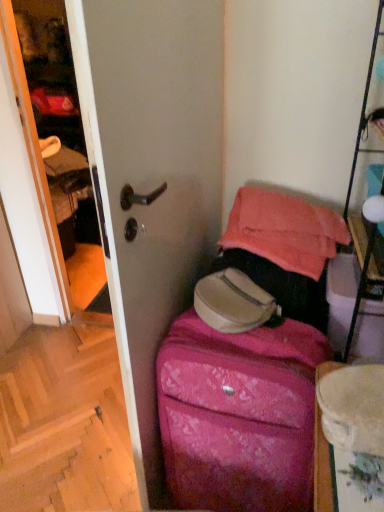
What do you see at coordinates (64, 423) in the screenshot? The width and height of the screenshot is (384, 512). I see `wooden at lower left` at bounding box center [64, 423].

Describe the element at coordinates (239, 415) in the screenshot. The height and width of the screenshot is (512, 384). I see `pink textured suitcase at center` at that location.

This screenshot has width=384, height=512. Identify the location of pink fabric suitcase at lower right. 153,180.

Can you confirm if wooden at lower left is shorter than pink fabric suitcase at lower right?

Indeed, wooden at lower left has a lesser height compared to pink fabric suitcase at lower right.

Image resolution: width=384 pixels, height=512 pixels. I want to click on screen door on the right of wooden at lower left, so click(153, 180).

Is wooden at lower left in front of or behind pink fabric suitcase at lower right in the image?

Visually, wooden at lower left is located behind pink fabric suitcase at lower right.

Considering the points (98, 362) and (156, 133), which point is behind, point (98, 362) or point (156, 133)?

Point (98, 362)

From the image's perspective, which object appears higher, pink fabric suitcase at lower right or wooden at lower left?

From the image's view, pink fabric suitcase at lower right is above.

I want to click on stairwell on the left of pink fabric suitcase at lower right, so click(x=64, y=423).

Would you say pink fabric suitcase at lower right is inside or outside wooden at lower left?

pink fabric suitcase at lower right lies outside wooden at lower left.

Is pink fabric suitcase at lower right to the right of wooden at lower left from the viewer's perspective?

Yes, pink fabric suitcase at lower right is to the right of wooden at lower left.

From the image's perspective, is pink textured suitcase at center on wooden at lower left?

Indeed, from the image's perspective, pink textured suitcase at center is shown above wooden at lower left.

From a real-world perspective, is pink textured suitcase at center positioned above or below wooden at lower left?

pink textured suitcase at center is above wooden at lower left.

Image resolution: width=384 pixels, height=512 pixels. Find the location of `stairwell below the pink textured suitcase at center (from the image's perspective)`. stairwell below the pink textured suitcase at center (from the image's perspective) is located at coordinates (64, 423).

Which object is positioned more to the left, pink textured suitcase at center or wooden at lower left?

Positioned to the left is wooden at lower left.

Considering the positions of objects pink fabric suitcase at lower right and pink textured suitcase at center in the image provided, who is more to the left, pink fabric suitcase at lower right or pink textured suitcase at center?

pink fabric suitcase at lower right is more to the left.

Can you confirm if pink fabric suitcase at lower right is smaller than pink textured suitcase at center?

Incorrect, pink fabric suitcase at lower right is not smaller in size than pink textured suitcase at center.

Considering the relative positions of pink fabric suitcase at lower right and pink textured suitcase at center in the image provided, is pink fabric suitcase at lower right behind pink textured suitcase at center?

No, pink fabric suitcase at lower right is closer to the camera.

Looking at this image, is pink fabric suitcase at lower right situated inside pink textured suitcase at center or outside?

The correct answer is: outside.

Locate an element on the screen. The image size is (384, 512). luggage in front of the wooden at lower left is located at coordinates (239, 415).

Is pink textured suitcase at center inside wooden at lower left?

Definitely not — pink textured suitcase at center is not inside wooden at lower left.

Looking at this image, between wooden at lower left and pink textured suitcase at center, which one appears on the left side from the viewer's perspective?

From the viewer's perspective, wooden at lower left appears more on the left side.

From the image's perspective, which is below, pink textured suitcase at center or pink fabric suitcase at lower right?

pink textured suitcase at center.

Could you tell me if pink textured suitcase at center is turned towards pink fabric suitcase at lower right?

No, pink textured suitcase at center is not facing towards pink fabric suitcase at lower right.

Where is `screen door above the pink textured suitcase at center (from the image's perspective)`? Image resolution: width=384 pixels, height=512 pixels. screen door above the pink textured suitcase at center (from the image's perspective) is located at coordinates (153, 180).

Would you say pink textured suitcase at center is inside or outside pink fabric suitcase at lower right?

pink textured suitcase at center is spatially situated outside pink fabric suitcase at lower right.

Identify the location of stairwell below the pink fabric suitcase at lower right (from a real-world perspective). The width and height of the screenshot is (384, 512). (64, 423).

I want to click on screen door above the wooden at lower left (from a real-world perspective), so click(153, 180).

Considering their positions, is pink fabric suitcase at lower right positioned further to pink textured suitcase at center than wooden at lower left?

wooden at lower left is further to pink textured suitcase at center.

When comparing their distances from wooden at lower left, does pink textured suitcase at center or pink fabric suitcase at lower right seem further?

Among the two, pink fabric suitcase at lower right is located further to wooden at lower left.

Based on their spatial positions, is pink fabric suitcase at lower right or pink textured suitcase at center closer to wooden at lower left?

pink textured suitcase at center is closer to wooden at lower left.

Which object lies nearer to the anchor point pink fabric suitcase at lower right, wooden at lower left or pink textured suitcase at center?

Based on the image, pink textured suitcase at center appears to be nearer to pink fabric suitcase at lower right.

Estimate the real-world distances between objects in this image. Which object is closer to pink fabric suitcase at lower right, pink textured suitcase at center or wooden at lower left?

Based on the image, pink textured suitcase at center appears to be nearer to pink fabric suitcase at lower right.

Looking at this image, estimate the real-world distances between objects in this image. Which object is further from pink textured suitcase at center, wooden at lower left or pink fabric suitcase at lower right?

wooden at lower left.

The image size is (384, 512). I want to click on screen door between wooden at lower left and pink textured suitcase at center in the horizontal direction, so click(x=153, y=180).